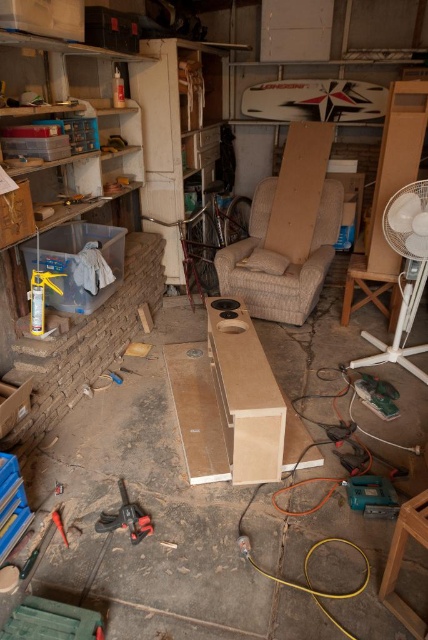
Is white plastic fan at right positioned at the back of black rubber drill at lower left?

Yes, white plastic fan at right is behind black rubber drill at lower left.

Can you confirm if white plastic fan at right is thinner than black rubber drill at lower left?

No.

Measure the distance between white plastic fan at right and camera.

white plastic fan at right and camera are 9.31 feet apart.

You are a GUI agent. You are given a task and a screenshot of the screen. Output one action in this format:
    pyautogui.click(x=<x>, y=<y>)
    Task: Click on the white plastic fan at right
    The height and width of the screenshot is (640, 428).
    Given the screenshot: What is the action you would take?
    pyautogui.click(x=404, y=273)

Who is shorter, beige fabric armchair at center or translucent plastic box at left?

With less height is translucent plastic box at left.

Measure the distance between beige fabric armchair at center and translucent plastic box at left.

They are 4.69 feet apart.

The height and width of the screenshot is (640, 428). What are the coordinates of `beige fabric armchair at center` in the screenshot? It's located at (288, 262).

Who is more distant from viewer, (x=124, y=228) or (x=53, y=509)?

Positioned behind is point (x=124, y=228).

Can you confirm if translucent plastic box at left is positioned below metal/brushed power drill at lower left?

No, translucent plastic box at left is not below metal/brushed power drill at lower left.

At what (x,y) coordinates should I click in order to perform the action: click on translucent plastic box at left. Please return your answer as a coordinate pair (x, y). The height and width of the screenshot is (640, 428). Looking at the image, I should click on (79, 262).